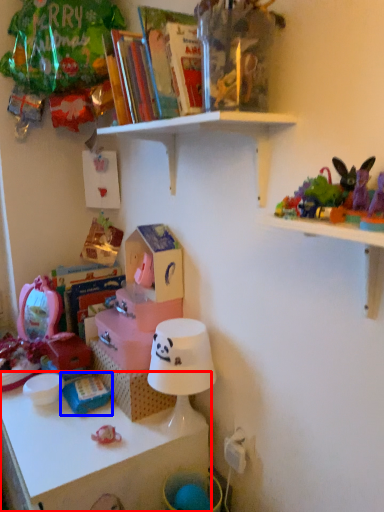
Question: Among these objects, which one is farthest to the camera, shelf (highlighted by a red box) or toy (highlighted by a blue box)?

Choices:
 (A) shelf
 (B) toy

Answer: (B)